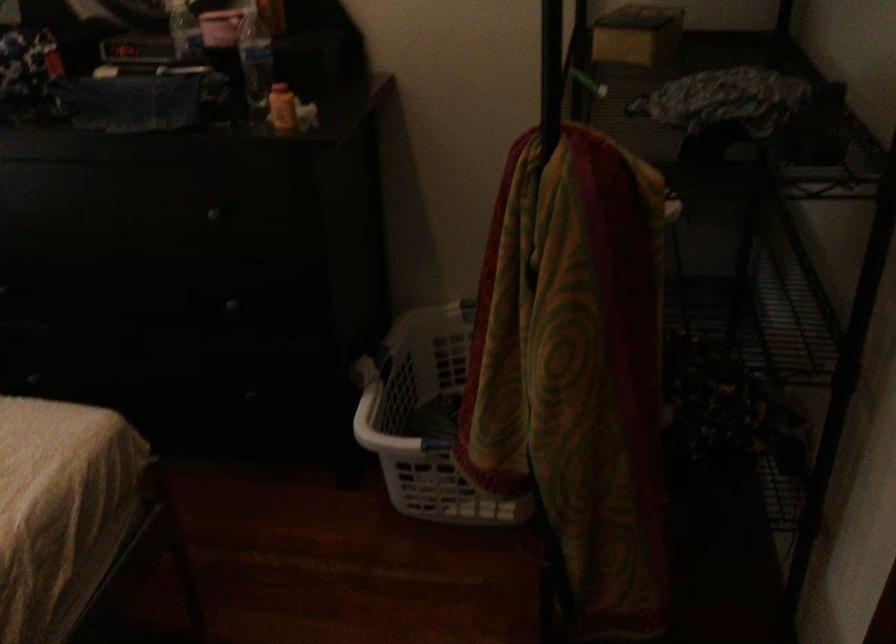
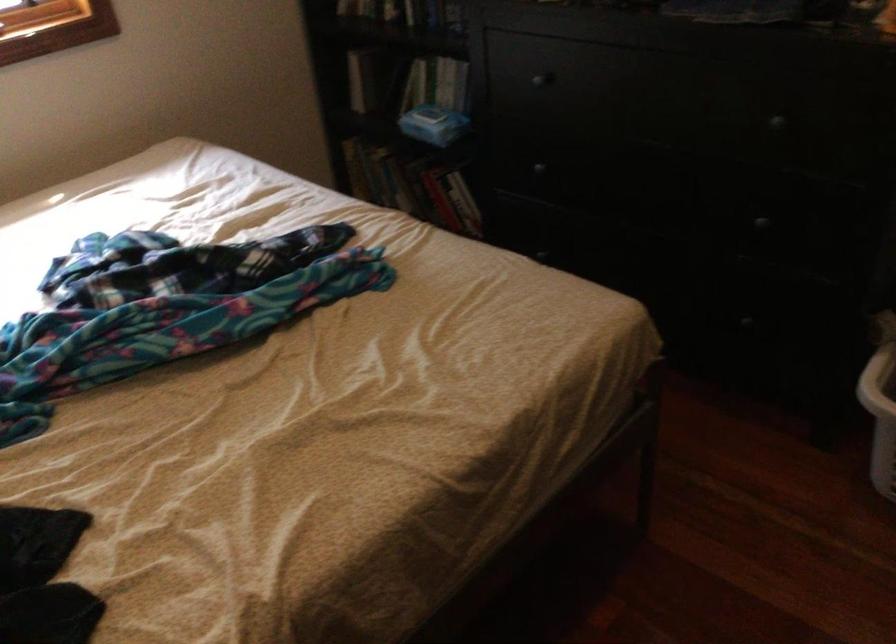
Locate, in the second image, the point that corresponds to [204,212] in the first image.

(773, 122)